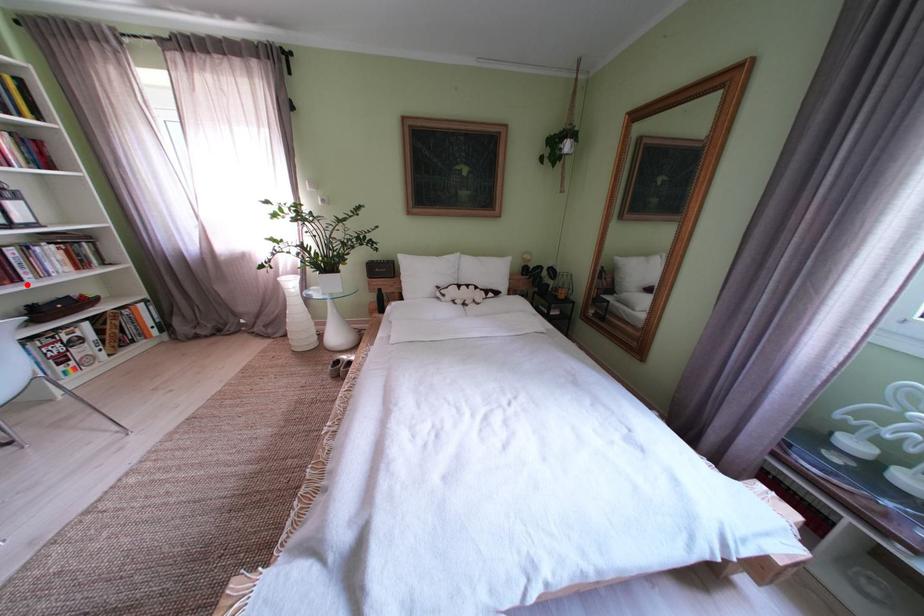
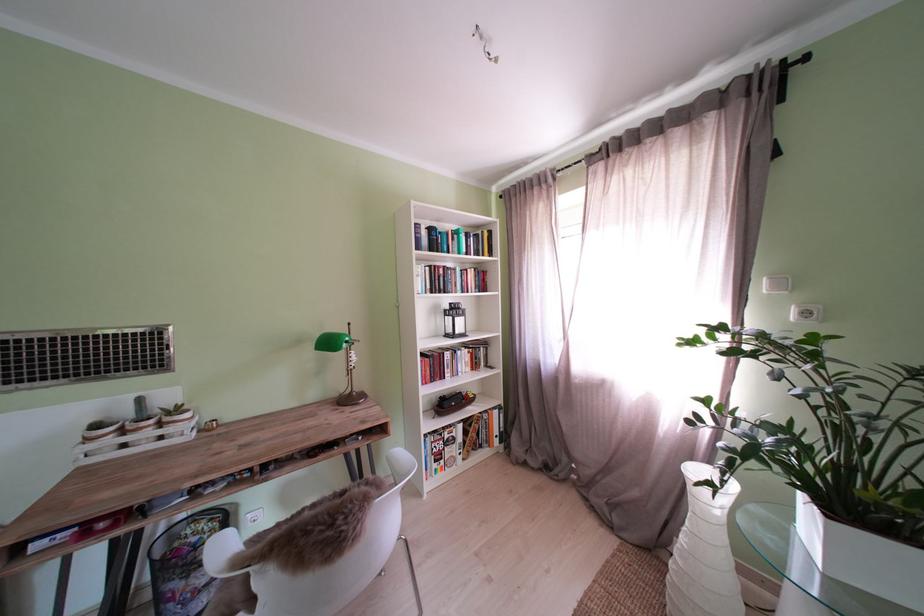
Where in the second image is the point corresponding to the highlighted location from the first image?

(454, 382)